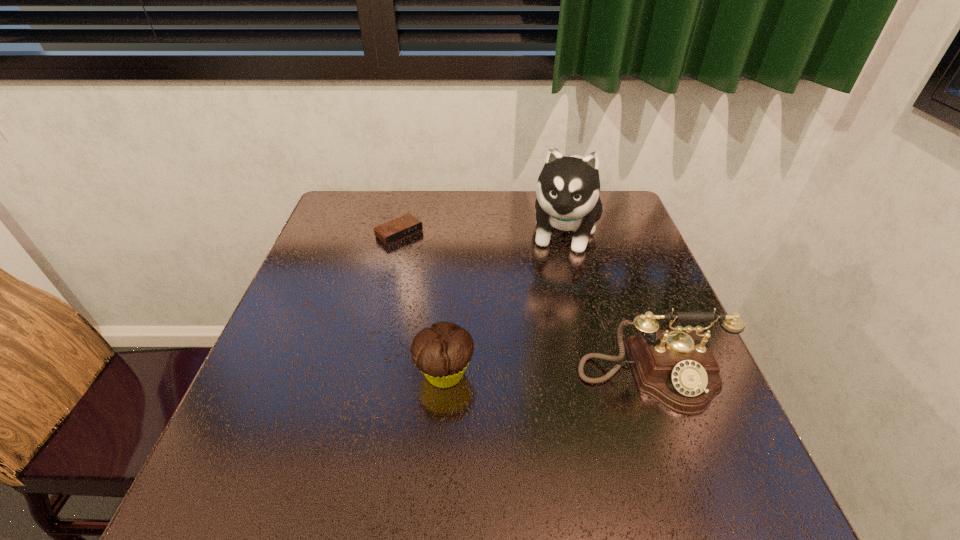
In order to click on object that is at the far left corner in this screenshot , I will do `click(402, 227)`.

This screenshot has height=540, width=960. What are the coordinates of `object located in the far right corner section of the desktop` in the screenshot? It's located at (568, 188).

Identify the location of object located in the near right corner section of the desktop. The image size is (960, 540). (676, 367).

In order to click on free space at the far edge in this screenshot , I will do `click(446, 196)`.

In the image, there is a desktop. Identify the location of vacant space at the near edge. (571, 448).

Find the location of a particular element. blank area at the left edge is located at coordinates (357, 303).

Find the location of a particular element. free space at the right edge is located at coordinates (631, 369).

I want to click on blank space at the near left corner of the desktop, so click(x=267, y=431).

Where is `vacant space at the far right corner of the desktop`? The width and height of the screenshot is (960, 540). vacant space at the far right corner of the desktop is located at coordinates (609, 219).

Image resolution: width=960 pixels, height=540 pixels. In the image, there is a desktop. Identify the location of free space at the near right corner. (732, 441).